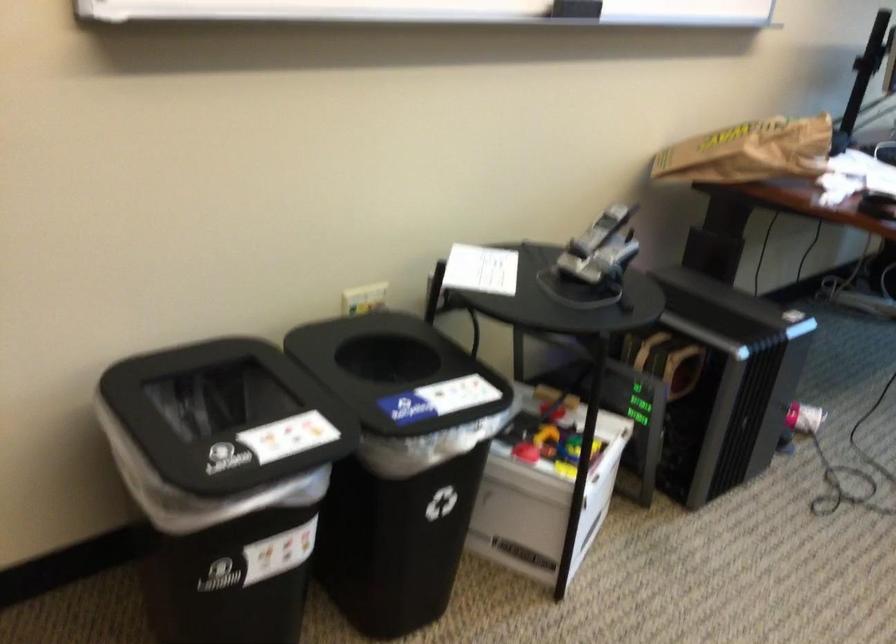
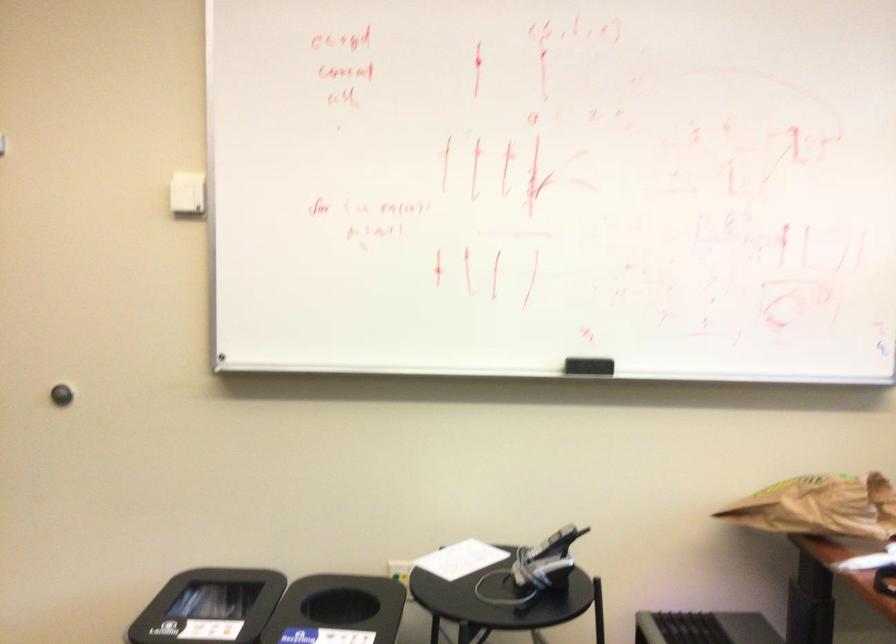
Locate, in the second image, the point that corresponds to [604,232] in the first image.

(552, 544)